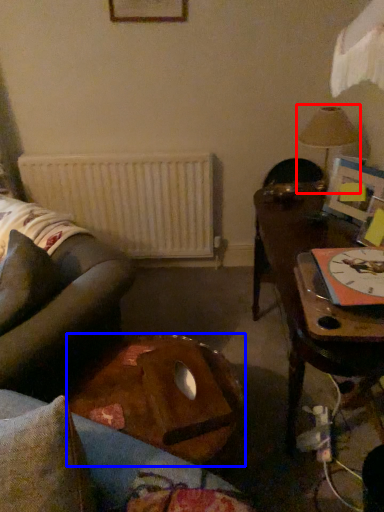
Question: Which object is closer to the camera taking this photo, lamp (highlighted by a red box) or table (highlighted by a blue box)?

Choices:
 (A) lamp
 (B) table

Answer: (B)